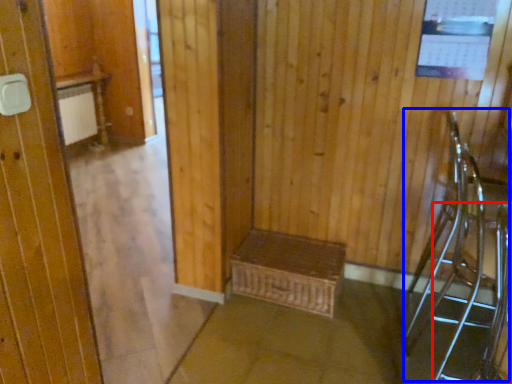
Question: Which of the following is the closest to the observer, armchair (highlighted by a red box) or armchair (highlighted by a blue box)?

Choices:
 (A) armchair
 (B) armchair

Answer: (A)